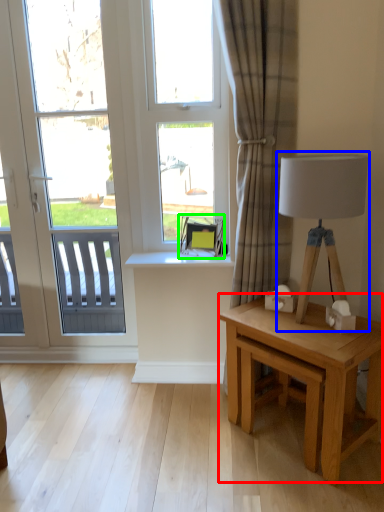
Question: Estimate the real-world distances between objects in this image. Which object is closer to table (highlighted by a red box), table lamp (highlighted by a blue box) or swivel chair (highlighted by a green box)?

Choices:
 (A) table lamp
 (B) swivel chair

Answer: (A)